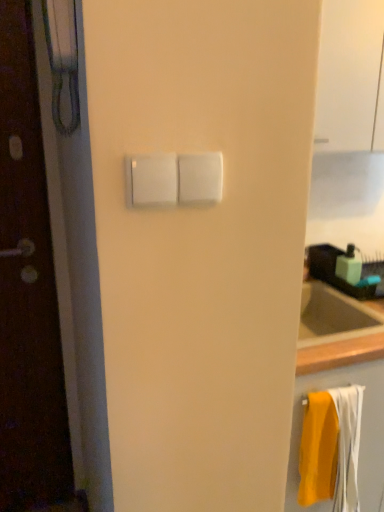
Question: Considering the relative positions of green matte soap dispenser at upper right and white plastic light switch at center in the image provided, is green matte soap dispenser at upper right to the left of white plastic light switch at center from the viewer's perspective?

Choices:
 (A) no
 (B) yes

Answer: (A)

Question: Is green matte soap dispenser at upper right positioned before white plastic light switch at center?

Choices:
 (A) no
 (B) yes

Answer: (A)

Question: Can you confirm if green matte soap dispenser at upper right is shorter than white plastic light switch at center?

Choices:
 (A) no
 (B) yes

Answer: (A)

Question: Is green matte soap dispenser at upper right positioned behind white plastic light switch at center?

Choices:
 (A) yes
 (B) no

Answer: (A)

Question: Is green matte soap dispenser at upper right wider than white plastic light switch at center?

Choices:
 (A) yes
 (B) no

Answer: (A)

Question: Is yellow fabric towel at lower right wider or thinner than transparent glass door at upper right?

Choices:
 (A) wide
 (B) thin

Answer: (B)

Question: From the image's perspective, is yellow fabric towel at lower right positioned above or below transparent glass door at upper right?

Choices:
 (A) above
 (B) below

Answer: (B)

Question: Is yellow fabric towel at lower right in front of or behind transparent glass door at upper right in the image?

Choices:
 (A) behind
 (B) front

Answer: (A)

Question: Considering the positions of yellow fabric towel at lower right and transparent glass door at upper right in the image, is yellow fabric towel at lower right bigger or smaller than transparent glass door at upper right?

Choices:
 (A) big
 (B) small

Answer: (B)

Question: Is green matte soap dispenser at upper right spatially inside transparent glass door at upper right, or outside of it?

Choices:
 (A) inside
 (B) outside

Answer: (B)

Question: In terms of width, does green matte soap dispenser at upper right look wider or thinner when compared to transparent glass door at upper right?

Choices:
 (A) thin
 (B) wide

Answer: (A)

Question: Is point (339, 271) closer or farther from the camera than point (349, 135)?

Choices:
 (A) closer
 (B) farther

Answer: (B)

Question: From the image's perspective, is green matte soap dispenser at upper right located above or below transparent glass door at upper right?

Choices:
 (A) above
 (B) below

Answer: (B)

Question: Which is correct: yellow fabric towel at lower right is inside green matte soap dispenser at upper right, or outside of it?

Choices:
 (A) outside
 (B) inside

Answer: (A)

Question: Is yellow fabric towel at lower right to the left or to the right of green matte soap dispenser at upper right in the image?

Choices:
 (A) right
 (B) left

Answer: (B)